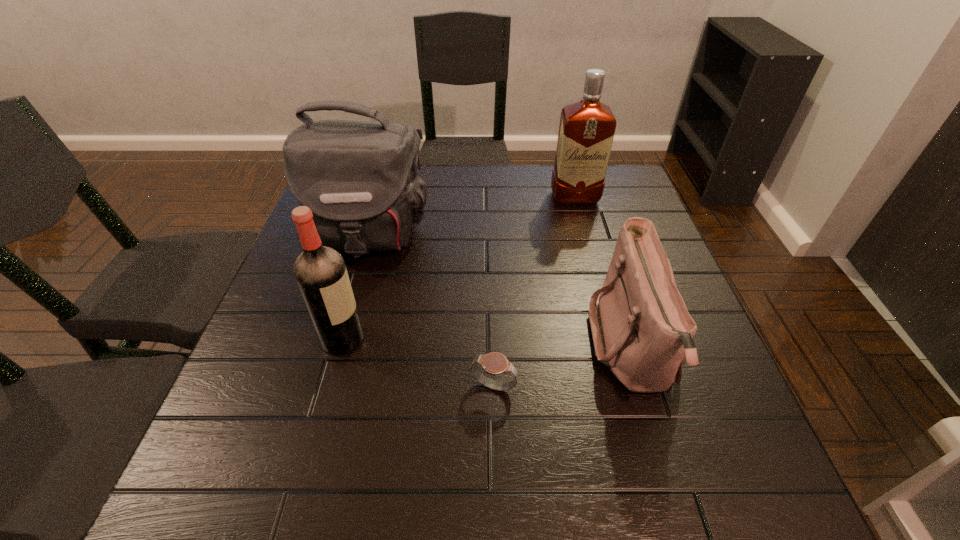
At what (x,y) coordinates should I click in order to perform the action: click on vacant space located on the front-facing side of the nearer liquor. Please return your answer as a coordinate pair (x, y). Looking at the image, I should click on (491, 339).

You are a GUI agent. You are given a task and a screenshot of the screen. Output one action in this format:
    pyautogui.click(x=<x>, y=<y>)
    Task: Click on the vacant area situated on the front pocket of the right shoulder bag
    The image size is (960, 540).
    Given the screenshot: What is the action you would take?
    [x=407, y=348]

Locate an element on the screen. This screenshot has height=540, width=960. free space located on the front pocket of the right shoulder bag is located at coordinates (417, 348).

Where is `free space located on the front pocket of the right shoulder bag`? This screenshot has height=540, width=960. free space located on the front pocket of the right shoulder bag is located at coordinates pyautogui.click(x=446, y=348).

Locate an element on the screen. This screenshot has width=960, height=540. vacant space located 0.330m on the left of the third object from right to left is located at coordinates (293, 388).

This screenshot has height=540, width=960. I want to click on liquor at the far edge, so click(x=586, y=131).

At what (x,y) coordinates should I click in order to perform the action: click on shoulder bag present at the far edge. Please return your answer as a coordinate pair (x, y). Looking at the image, I should click on (360, 179).

Where is `shoulder bag that is at the left edge`? shoulder bag that is at the left edge is located at coordinates (360, 179).

Locate an element on the screen. The width and height of the screenshot is (960, 540). liquor that is at the left edge is located at coordinates (320, 271).

Locate an element on the screen. liquor present at the right edge is located at coordinates (586, 131).